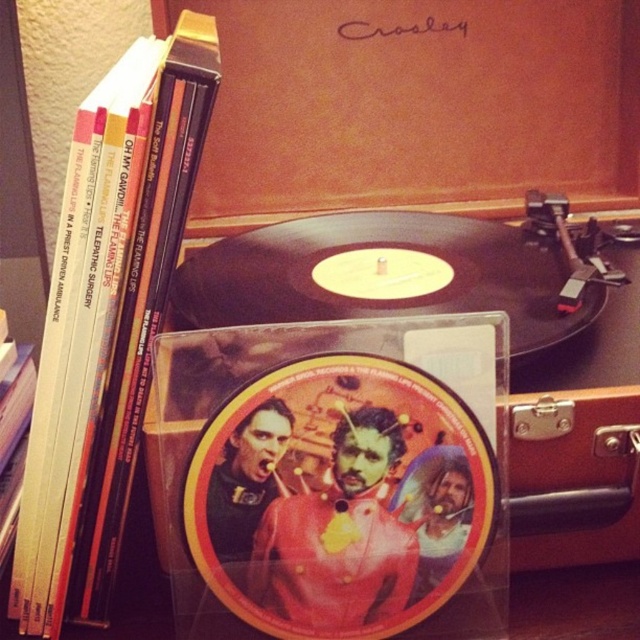
Is matte vinyl record at center bigger than hardcover book at left?

No, matte vinyl record at center is not bigger than hardcover book at left.

Does matte vinyl record at center have a lesser height compared to hardcover book at left?

Indeed, matte vinyl record at center has a lesser height compared to hardcover book at left.

Who is more forward, (492, 588) or (81, 122)?

Positioned in front is point (81, 122).

Find the location of a particular element. matte vinyl record at center is located at coordinates (337, 477).